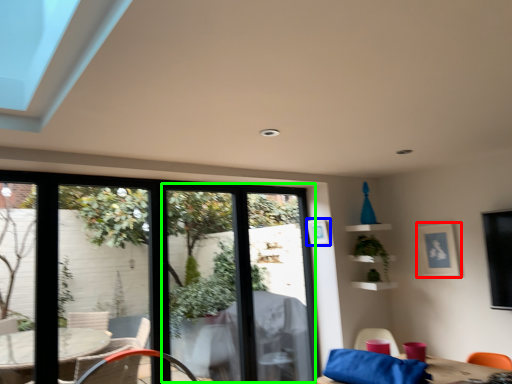
Question: Which object is the closest to the picture frame (highlighted by a red box)? Choose among these: picture frame (highlighted by a blue box) or screen door (highlighted by a green box).

Choices:
 (A) picture frame
 (B) screen door

Answer: (A)